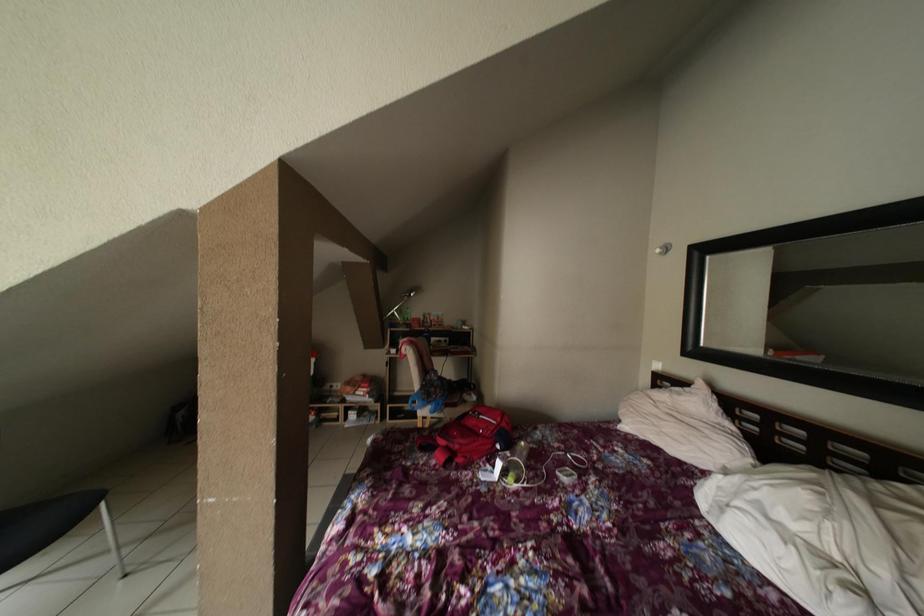
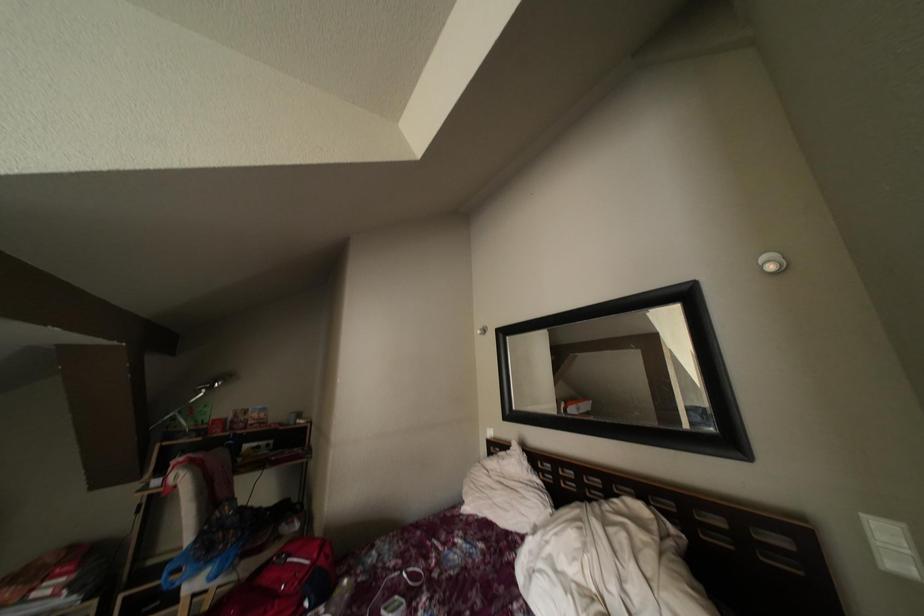
The first image is from the beginning of the video and the second image is from the end. How did the camera likely rotate when shooting the video?

The camera's rotation is toward right-up.